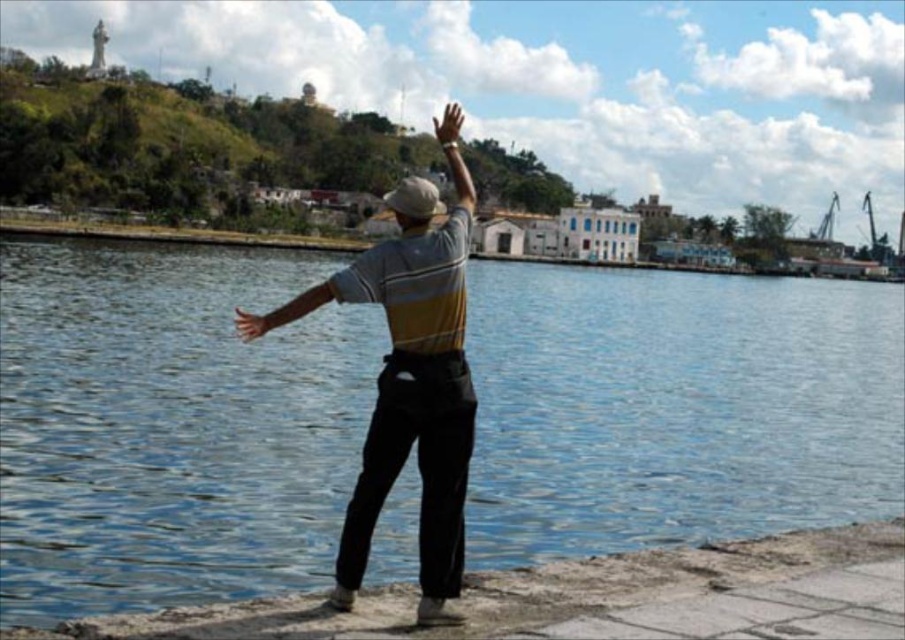
Is the position of beige fabric baseball hat at center more distant than that of smooth skin hand at center?

Yes, beige fabric baseball hat at center is further from the viewer.

Can you confirm if beige fabric baseball hat at center is taller than smooth skin hand at center?

Correct, beige fabric baseball hat at center is much taller as smooth skin hand at center.

Is point (418, 193) closer to camera compared to point (246, 321)?

That is True.

The image size is (905, 640). I want to click on beige fabric baseball hat at center, so click(414, 198).

From the picture: Can you confirm if brown leather hand at upper center is bigger than smooth skin hand at center?

Indeed, brown leather hand at upper center has a larger size compared to smooth skin hand at center.

Is brown leather hand at upper center closer to camera compared to smooth skin hand at center?

No, it is not.

Locate an element on the screen. This screenshot has height=640, width=905. brown leather hand at upper center is located at coordinates (448, 124).

Find the location of a particular element. Image resolution: width=905 pixels, height=640 pixels. brown leather hand at upper center is located at coordinates (448, 124).

Can you confirm if blue water at center is bigger than matte gray arm at upper center?

Indeed, blue water at center has a larger size compared to matte gray arm at upper center.

Does blue water at center appear on the left side of matte gray arm at upper center?

Incorrect, blue water at center is not on the left side of matte gray arm at upper center.

Locate an element on the screen. blue water at center is located at coordinates pyautogui.click(x=170, y=426).